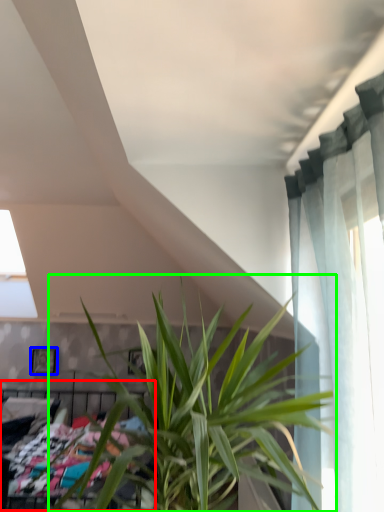
Question: Which object is positioned closest to bed (highlighted by a red box)? Select from picture frame (highlighted by a blue box) and houseplant (highlighted by a green box).

Choices:
 (A) picture frame
 (B) houseplant

Answer: (B)